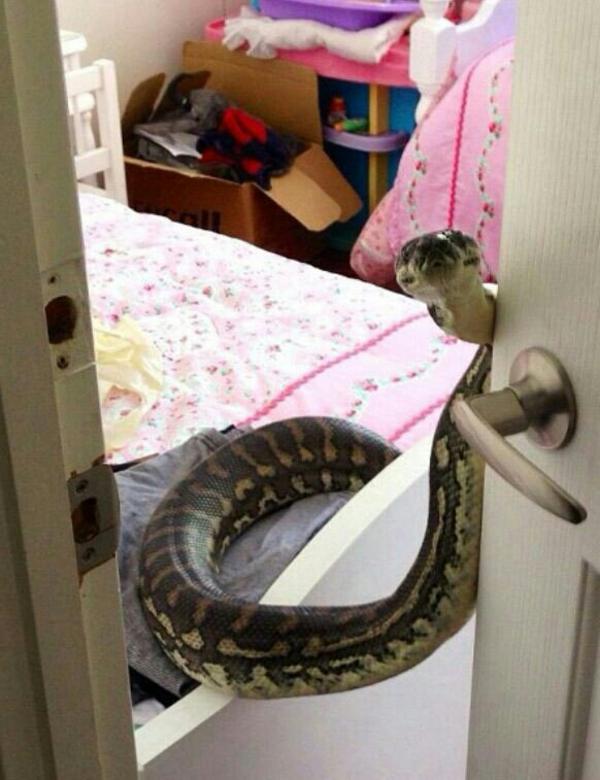
You are a GUI agent. You are given a task and a screenshot of the screen. Output one action in this format:
    pyautogui.click(x=<x>, y=<y>)
    Task: Click on the cardboard box
    The height and width of the screenshot is (780, 600).
    Given the screenshot: What is the action you would take?
    pyautogui.click(x=234, y=214)